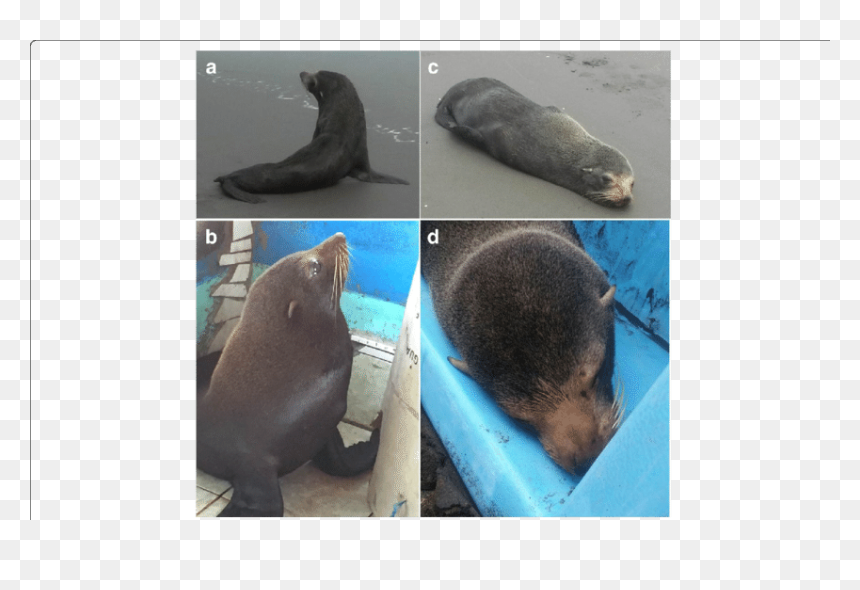
Identify the location of floor. pos(316,494).